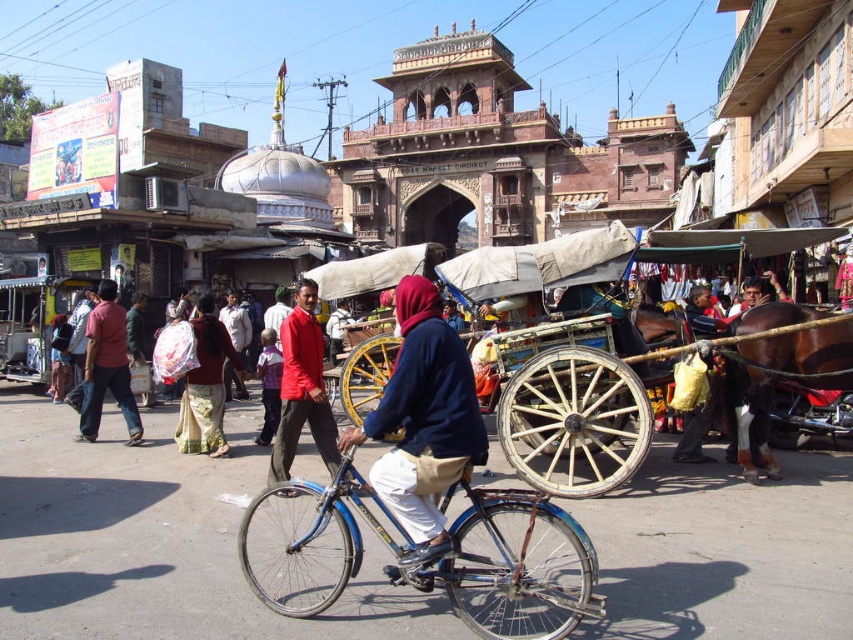
Question: Does wooden cart at center appear under matte red saree at center?

Choices:
 (A) no
 (B) yes

Answer: (A)

Question: Which of these objects is positioned farthest from the matte red saree at center?

Choices:
 (A) red matte jacket at center
 (B) blue metallic bicycle at center
 (C) blue fabric at center
 (D) wooden cart at center

Answer: (B)

Question: Does brown glossy horse at right have a lesser width compared to red shirt at center?

Choices:
 (A) yes
 (B) no

Answer: (A)

Question: Which object appears farthest from the camera in this image?

Choices:
 (A) matte red saree at center
 (B) red shirt at center
 (C) wooden cart at center

Answer: (B)

Question: Which object is positioned farthest from the red fabric headscarf at center?

Choices:
 (A) brown glossy horse at right
 (B) red matte jacket at center
 (C) wooden cart at center
 (D) blue metallic bicycle at center

Answer: (A)

Question: Can you confirm if brown glossy horse at right is positioned above red fabric headscarf at center?

Choices:
 (A) no
 (B) yes

Answer: (B)